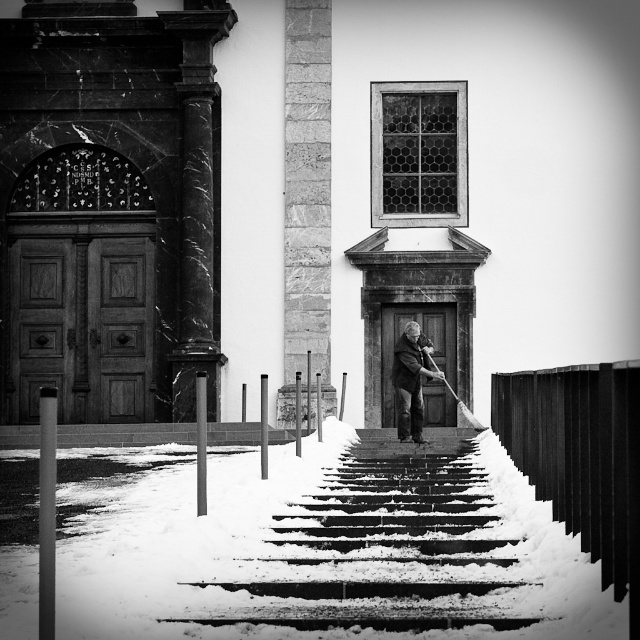
Question: Which point is farther from the camera taking this photo?

Choices:
 (A) (417, 352)
 (B) (328, 550)

Answer: (A)

Question: In this image, where is snow-covered concrete stairs at center located relative to dark gray wool sweater at center?

Choices:
 (A) right
 (B) left

Answer: (B)

Question: Which point is farther from the camera taking this photo?

Choices:
 (A) (406, 429)
 (B) (378, 508)

Answer: (A)

Question: Does snow-covered concrete stairs at center appear on the left side of dark gray wool sweater at center?

Choices:
 (A) no
 (B) yes

Answer: (B)

Question: Is snow-covered concrete stairs at center further to the viewer compared to dark gray wool sweater at center?

Choices:
 (A) no
 (B) yes

Answer: (A)